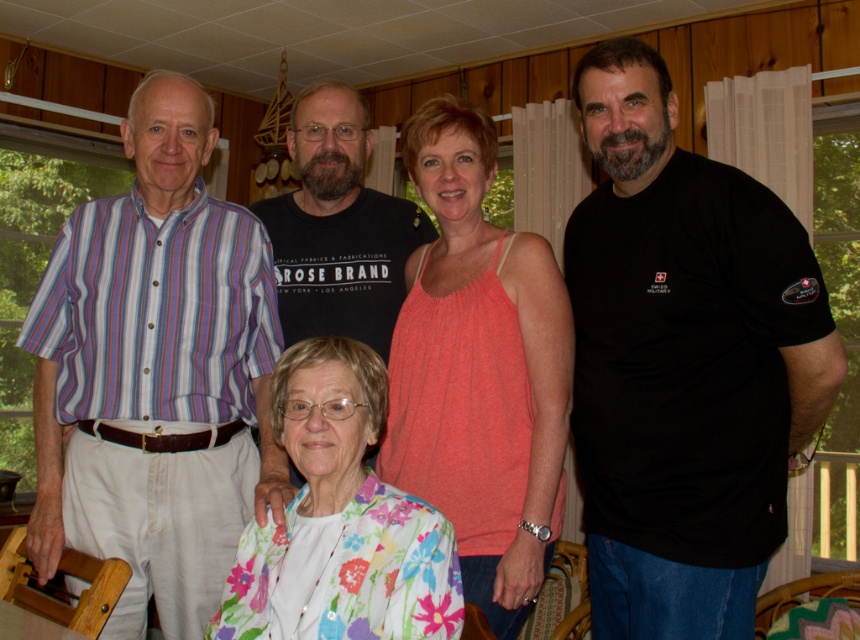
You are a photographer setting up for a group photo. You have two subjects wearing a striped cotton shirt at left and a floral fabric blouse at lower center. Which clothing item appears bigger in the photo?

The striped cotton shirt at left appears bigger in the photo than the floral fabric blouse at lower center because it is larger in size.

You are standing in the room and want to find the striped cotton shirt at left. Where should you look relative to the point at coordinates point (155, 374)?

The point at coordinates point (155, 374) is on the striped cotton shirt at left, so you should look directly at that point to find the striped cotton shirt at left.